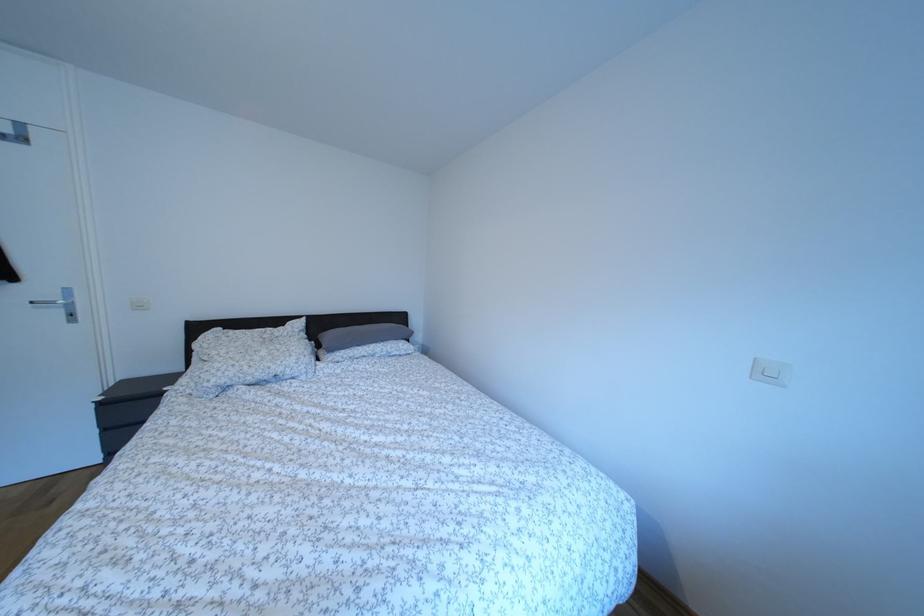
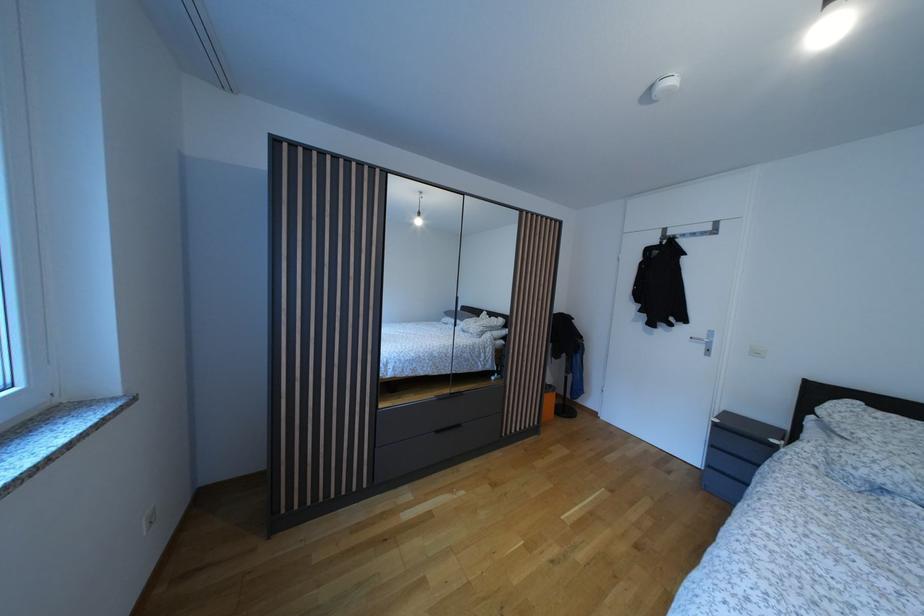
Question: The images are taken continuously from a first-person perspective. In which direction is your viewpoint rotating?

Choices:
 (A) Left
 (B) Right
 (C) Up
 (D) Down

Answer: (A)